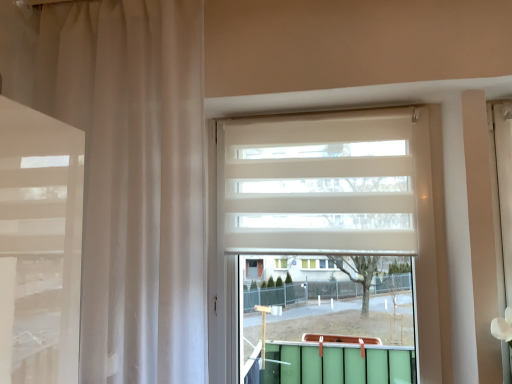
Question: From a real-world perspective, is white matte blind at center on sheer white curtain at left?

Choices:
 (A) no
 (B) yes

Answer: (B)

Question: Is white matte blind at center positioned far away from sheer white curtain at left?

Choices:
 (A) yes
 (B) no

Answer: (B)

Question: Is sheer white curtain at left completely or partially inside white matte blind at center?

Choices:
 (A) yes
 (B) no

Answer: (B)

Question: Does white matte blind at center have a lesser width compared to sheer white curtain at left?

Choices:
 (A) no
 (B) yes

Answer: (B)

Question: Is white matte blind at center positioned behind sheer white curtain at left?

Choices:
 (A) no
 (B) yes

Answer: (B)

Question: Considering the relative positions of white matte blind at center and sheer white curtain at left in the image provided, is white matte blind at center to the left of sheer white curtain at left from the viewer's perspective?

Choices:
 (A) no
 (B) yes

Answer: (A)

Question: Is white matte window at center at the left side of sheer white curtain at left?

Choices:
 (A) yes
 (B) no

Answer: (B)

Question: Is white matte window at center shorter than sheer white curtain at left?

Choices:
 (A) yes
 (B) no

Answer: (A)

Question: Is white matte window at center thinner than sheer white curtain at left?

Choices:
 (A) yes
 (B) no

Answer: (A)

Question: Is white matte window at center facing away from sheer white curtain at left?

Choices:
 (A) yes
 (B) no

Answer: (B)

Question: Can you confirm if white matte window at center is smaller than sheer white curtain at left?

Choices:
 (A) no
 (B) yes

Answer: (B)

Question: Is the depth of white matte window at center less than that of sheer white curtain at left?

Choices:
 (A) yes
 (B) no

Answer: (B)

Question: From the image's perspective, is sheer white curtain at left beneath white matte window at center?

Choices:
 (A) yes
 (B) no

Answer: (B)